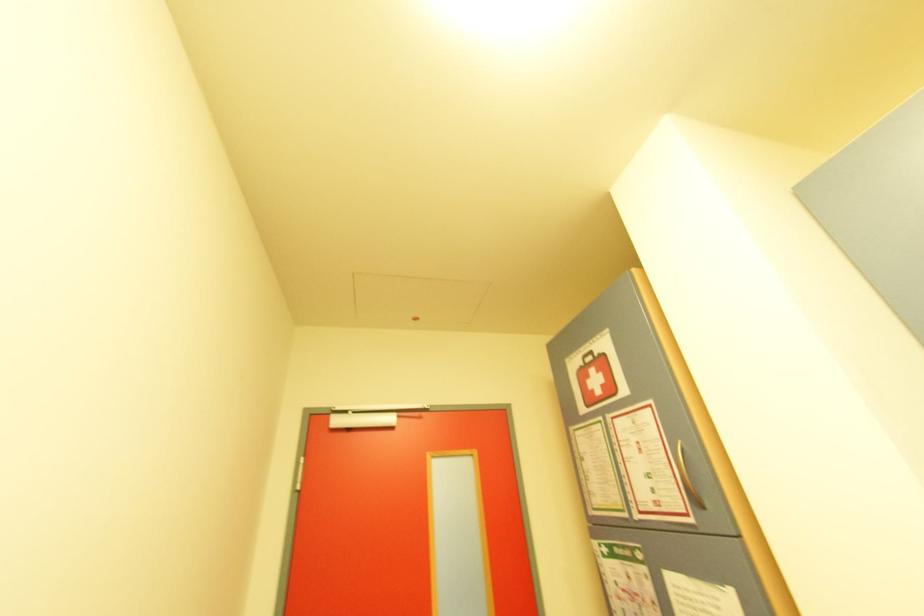
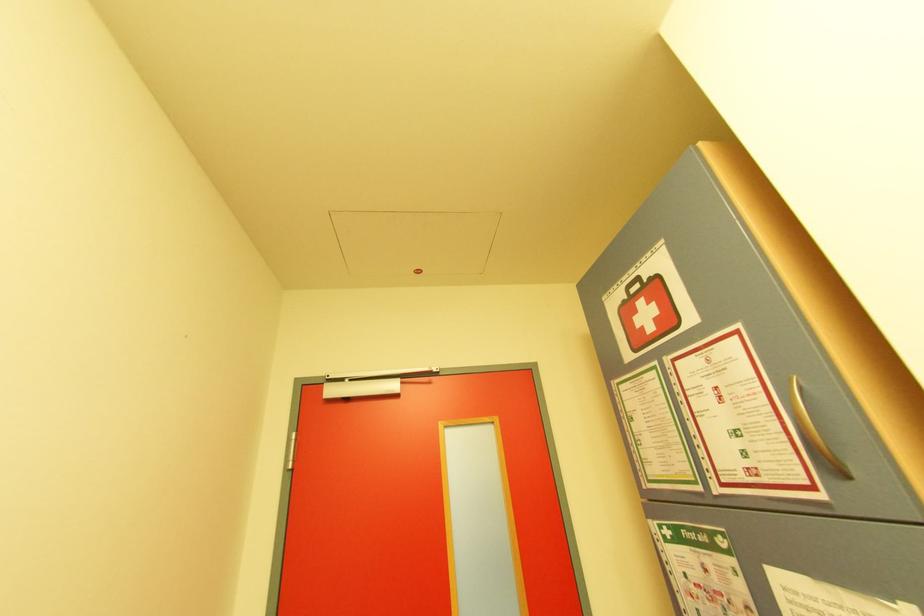
Question: Based on the continuous images, in which direction is the camera rotating? Reply with the corresponding letter.

Choices:
 (A) Left
 (B) Right
 (C) Up
 (D) Down

Answer: (A)